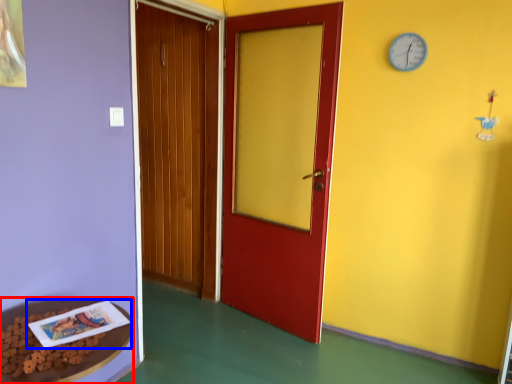
Question: Which of the following is the closest to the observer, table (highlighted by a red box) or book (highlighted by a blue box)?

Choices:
 (A) table
 (B) book

Answer: (A)